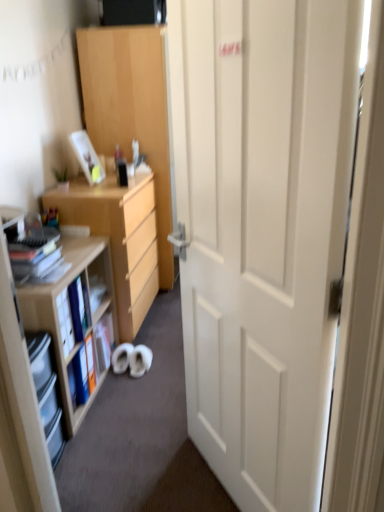
The width and height of the screenshot is (384, 512). What do you see at coordinates (46, 391) in the screenshot?
I see `clear plastic shelves at left, the first shelf from the front` at bounding box center [46, 391].

Describe the element at coordinates (31, 246) in the screenshot. I see `matte black book at left` at that location.

This screenshot has width=384, height=512. Find the location of `light brown wooden desk at left`. light brown wooden desk at left is located at coordinates (119, 238).

Looking at this image, measure the distance between point (109, 76) and camera.

9.65 feet.

Where is `clear plastic shelves at left, the first shelf from the front`? The width and height of the screenshot is (384, 512). clear plastic shelves at left, the first shelf from the front is located at coordinates (46, 391).

Who is bigger, light wood cabinet at center or matte plastic picture frame at upper left?

light wood cabinet at center is bigger.

Between light wood cabinet at center and matte plastic picture frame at upper left, which one is positioned behind?

light wood cabinet at center is further away from the camera.

What are the coordinates of `picture frame below the light wood cabinet at center (from the image's perspective)` in the screenshot? It's located at (87, 157).

Is light wood cabinet at center positioned far away from matte plastic picture frame at upper left?

No, light wood cabinet at center is not far from matte plastic picture frame at upper left.

In terms of width, does light wood cabinet at center look wider or thinner when compared to wooden bookshelf at left, acting as the 2th shelf starting from the front?

light wood cabinet at center is wider than wooden bookshelf at left, acting as the 2th shelf starting from the front.

Is point (166, 208) positioned after point (66, 386)?

Yes, point (166, 208) is farther from viewer.

This screenshot has width=384, height=512. I want to click on cabinetry behind the wooden bookshelf at left, positioned as the first shelf in back-to-front order, so click(131, 110).

Looking at the image, does light wood cabinet at center seem bigger or smaller compared to wooden bookshelf at left, acting as the 2th shelf starting from the front?

In the image, light wood cabinet at center appears to be larger than wooden bookshelf at left, acting as the 2th shelf starting from the front.

Could you tell me if green matte plant at upper left is turned towards white matte door at center?

No, green matte plant at upper left is not turned towards white matte door at center.

Which of these two, green matte plant at upper left or white matte door at center, is wider?

white matte door at center is wider.

From a real-world perspective, does green matte plant at upper left sit lower than white matte door at center?

No, from a real-world perspective, green matte plant at upper left is not below white matte door at center.

How far apart are white matte door at center and clear plastic shelves at left, the first shelf from the front?

white matte door at center and clear plastic shelves at left, the first shelf from the front, are 87.07 centimeters apart from each other.

Looking at this image, is white matte door at center placed right next to clear plastic shelves at left, the first shelf from the front?

No, white matte door at center is not next to clear plastic shelves at left, the first shelf from the front.

Looking at their sizes, would you say white matte door at center is wider or thinner than clear plastic shelves at left, positioned as the second shelf in back-to-front order?

Clearly, white matte door at center has more width compared to clear plastic shelves at left, positioned as the second shelf in back-to-front order.

Which of these two, white matte door at center or clear plastic shelves at left, positioned as the second shelf in back-to-front order, stands shorter?

clear plastic shelves at left, positioned as the second shelf in back-to-front order, is shorter.

Are green matte plant at upper left and light wood cabinet at center far apart?

No, green matte plant at upper left is not far away from light wood cabinet at center.

Between point (65, 168) and point (166, 283), which one is positioned in front?

The point (65, 168) is more forward.

From a real-world perspective, is green matte plant at upper left over light wood cabinet at center?

Yes.

Is green matte plant at upper left facing towards light wood cabinet at center?

No, green matte plant at upper left is not aimed at light wood cabinet at center.

Considering the sizes of matte black book at left and wooden bookshelf at left, acting as the 2th shelf starting from the front, in the image, is matte black book at left taller or shorter than wooden bookshelf at left, acting as the 2th shelf starting from the front,?

Considering their sizes, matte black book at left has less height than wooden bookshelf at left, acting as the 2th shelf starting from the front.

Does matte black book at left contain wooden bookshelf at left, acting as the 2th shelf starting from the front?

No, wooden bookshelf at left, acting as the 2th shelf starting from the front, is located outside of matte black book at left.

Is matte black book at left facing towards wooden bookshelf at left, positioned as the first shelf in back-to-front order?

No, matte black book at left does not turn towards wooden bookshelf at left, positioned as the first shelf in back-to-front order.

Looking at their sizes, would you say matte black book at left is wider or thinner than wooden bookshelf at left, positioned as the first shelf in back-to-front order?

matte black book at left is thinner than wooden bookshelf at left, positioned as the first shelf in back-to-front order.

Which of these two, white matte door at center or light wood cabinet at center, is smaller?

Smaller between the two is white matte door at center.

Measure the distance between white matte door at center and light wood cabinet at center.

white matte door at center and light wood cabinet at center are 5.75 feet apart.

Which object is positioned more to the left, white matte door at center or light wood cabinet at center?

light wood cabinet at center.

How different are the orientations of white matte door at center and light wood cabinet at center in degrees?

white matte door at center and light wood cabinet at center are facing 150 degrees away from each other.

The height and width of the screenshot is (512, 384). Find the location of `picture frame above the light wood cabinet at center (from a real-world perspective)`. picture frame above the light wood cabinet at center (from a real-world perspective) is located at coordinates (87, 157).

From a real-world perspective, starting from the light wood cabinet at center, which shelf is the 1st one below it? Please provide its 2D coordinates.

[(70, 311)]

Based on their spatial positions, is matte black book at left or green matte plant at upper left further from matte plastic picture frame at upper left?

matte black book at left.

Based on their spatial positions, is light wood cabinet at center or matte black book at left closer to white matte door at center?

Among the two, matte black book at left is located nearer to white matte door at center.

When comparing their distances from white matte door at center, does light wood cabinet at center or matte plastic picture frame at upper left seem further?

light wood cabinet at center.

Estimate the real-world distances between objects in this image. Which object is further from light brown wooden desk at left, matte black book at left or light wood cabinet at center?

The object further to light brown wooden desk at left is matte black book at left.

From the image, which object appears to be farther from white matte door at center, green matte plant at upper left or wooden bookshelf at left, acting as the 2th shelf starting from the front?

green matte plant at upper left is further to white matte door at center.

Estimate the real-world distances between objects in this image. Which object is closer to matte plastic picture frame at upper left, wooden bookshelf at left, positioned as the first shelf in back-to-front order, or clear plastic shelves at left, the first shelf from the front?

wooden bookshelf at left, positioned as the first shelf in back-to-front order.

Estimate the real-world distances between objects in this image. Which object is closer to wooden bookshelf at left, positioned as the first shelf in back-to-front order, light wood cabinet at center or green matte plant at upper left?

green matte plant at upper left.

Based on their spatial positions, is white matte door at center or wooden bookshelf at left, positioned as the first shelf in back-to-front order, closer to matte black book at left?

Based on the image, wooden bookshelf at left, positioned as the first shelf in back-to-front order, appears to be nearer to matte black book at left.

Where is `picture frame positioned between white matte door at center and light wood cabinet at center from near to far`? This screenshot has width=384, height=512. picture frame positioned between white matte door at center and light wood cabinet at center from near to far is located at coordinates (87, 157).

Find the location of `houseplant between light wood cabinet at center and wooden bookshelf at left, acting as the 2th shelf starting from the front, vertically`. houseplant between light wood cabinet at center and wooden bookshelf at left, acting as the 2th shelf starting from the front, vertically is located at coordinates (61, 179).

Identify the location of picture frame between matte black book at left and light wood cabinet at center from front to back. (87, 157).

The height and width of the screenshot is (512, 384). I want to click on shelf between green matte plant at upper left and clear plastic shelves at left, positioned as the second shelf in back-to-front order, vertically, so [x=70, y=311].